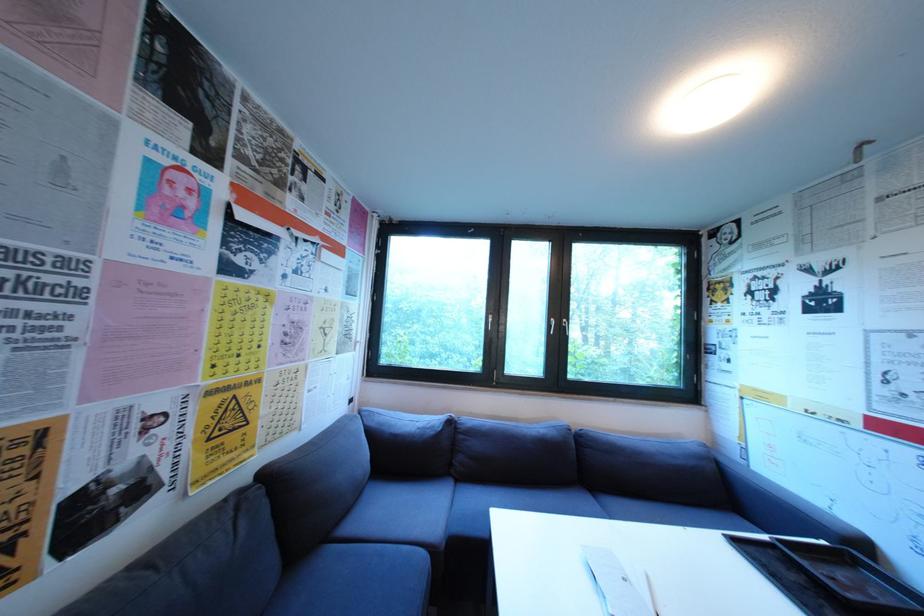
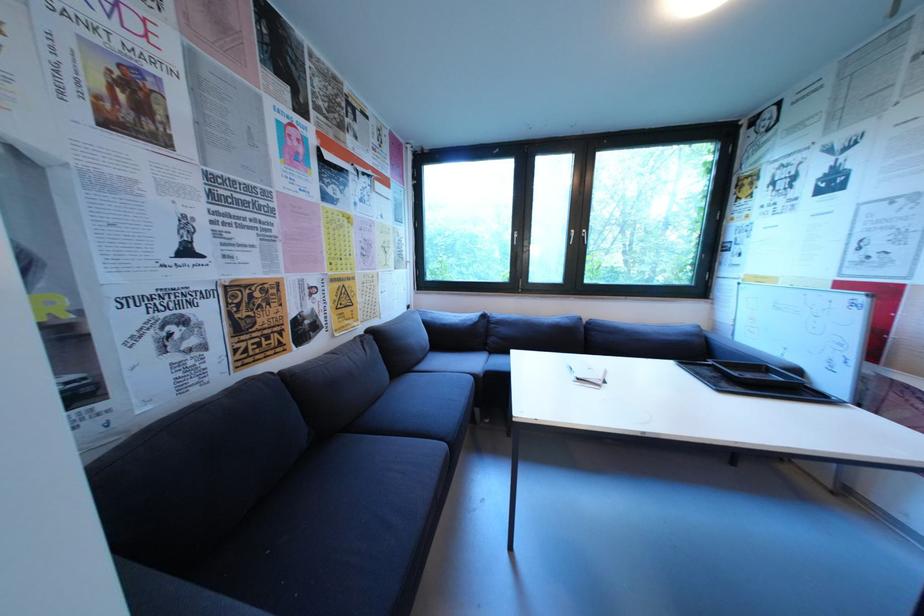
Question: What movement of the cameraman would produce the second image?

Choices:
 (A) Left
 (B) Right
 (C) Forward
 (D) Backward

Answer: (D)